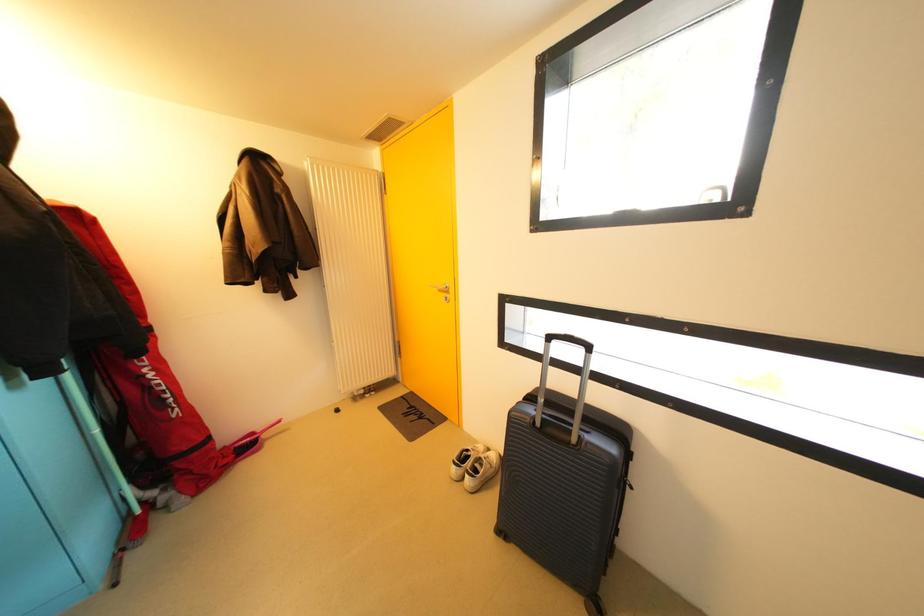
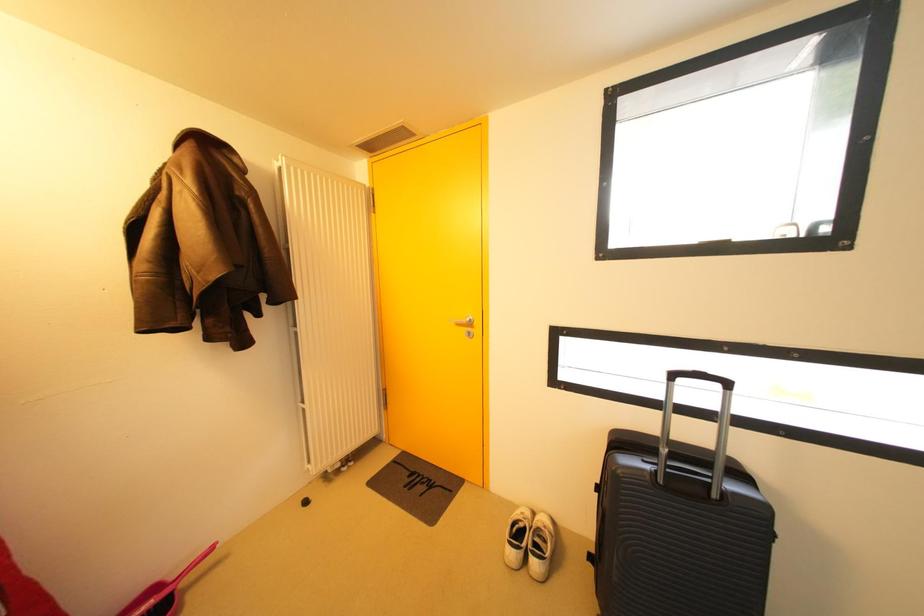
Question: The images are taken continuously from a first-person perspective. In which direction is your viewpoint rotating?

Choices:
 (A) Left
 (B) Right
 (C) Up
 (D) Down

Answer: (B)